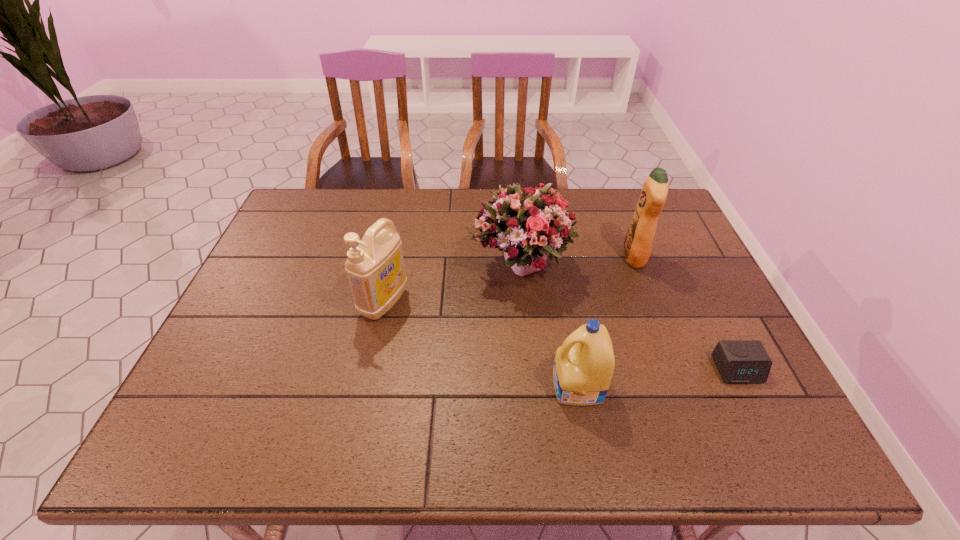
In the image, there is a desktop. In order to click on vacant space at the far edge in this screenshot , I will do `click(455, 218)`.

In order to click on vacant space at the near edge of the desktop in this screenshot , I will do tap(318, 419).

In the image, there is a desktop. At what (x,y) coordinates should I click in order to perform the action: click on free region at the left edge. Please return your answer as a coordinate pair (x, y). Looking at the image, I should click on (238, 357).

In the image, there is a desktop. Identify the location of free space at the far left corner. The height and width of the screenshot is (540, 960). (315, 220).

Image resolution: width=960 pixels, height=540 pixels. What are the coordinates of `vacant space at the near right corner` in the screenshot? It's located at (776, 439).

At what (x,y) coordinates should I click in order to perform the action: click on vacant area between the bouquet and the second shortest object. Please return your answer as a coordinate pair (x, y). The image size is (960, 540). Looking at the image, I should click on (549, 326).

Image resolution: width=960 pixels, height=540 pixels. I want to click on vacant area that lies between the alarm clock and the farthest detergent, so click(685, 313).

You are a GUI agent. You are given a task and a screenshot of the screen. Output one action in this format:
    pyautogui.click(x=<x>, y=<y>)
    Task: Click on the free space between the alarm clock and the bouquet
    The width and height of the screenshot is (960, 540).
    Given the screenshot: What is the action you would take?
    pyautogui.click(x=629, y=318)

The width and height of the screenshot is (960, 540). What are the coordinates of `vacant region between the shortest object and the nearest detergent` in the screenshot? It's located at (658, 378).

Image resolution: width=960 pixels, height=540 pixels. I want to click on unoccupied position between the second detergent from right to left and the leftmost detergent, so click(481, 345).